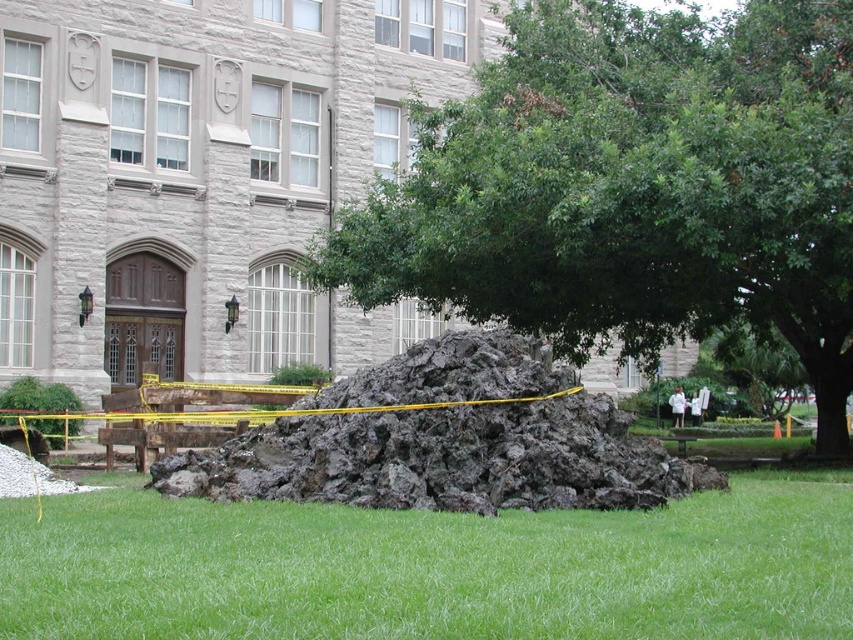
You are standing at the point marked by coordinates point (795,323) in an outdoor area with a large mound of dark material in front of a stone building. You want to take a photo of the entire scene. Would you need to move closer or farther away to ensure both the mound and the building are fully visible in your camera frame?

Since you are 20.58 meters away from point (795,323), you might need to move farther away to ensure both the mound and the building are fully visible in your camera frame.

You are a landscape architect designing a pathway between the green leafy tree at center and the green grass at lower center. If the pathway must be at least 1 meter wide, can you fit it between them?

The distance between the green leafy tree at center and the green grass at lower center is 8.69 meters, so yes, a 1 meter wide pathway can easily be placed between them.